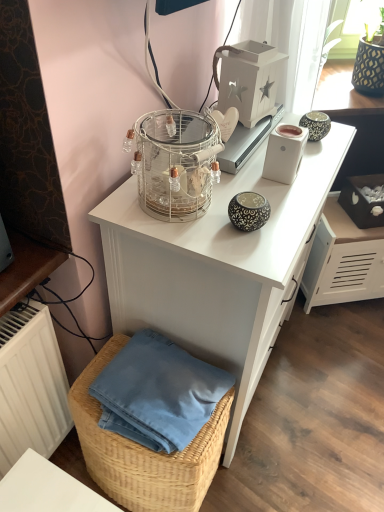
Question: Is woven straw basket at lower left wider or thinner than white wooden lantern at upper center, which is the 2th appliance from bottom to top?

Choices:
 (A) wide
 (B) thin

Answer: (A)

Question: Does point (173, 465) appear closer or farther from the camera than point (276, 61)?

Choices:
 (A) farther
 (B) closer

Answer: (B)

Question: Estimate the real-world distances between objects in this image. Which object is farther from the black cardboard box at right?

Choices:
 (A) woven straw basket at lower left
 (B) white matte file cabinet at right
 (C) clear glass birdcage at upper center
 (D) white glossy desk at upper center
 (E) white wooden lantern at upper center, acting as the first appliance starting from the top

Answer: (A)

Question: Estimate the real-world distances between objects in this image. Which object is farther from the clear glass birdcage at upper center?

Choices:
 (A) black cardboard box at right
 (B) white glossy desk at upper center
 (C) white matte rectangular device at upper center, the 2th appliance when ordered from top to bottom
 (D) white wooden lantern at upper center, acting as the first appliance starting from the top
 (E) woven straw basket at lower left

Answer: (A)